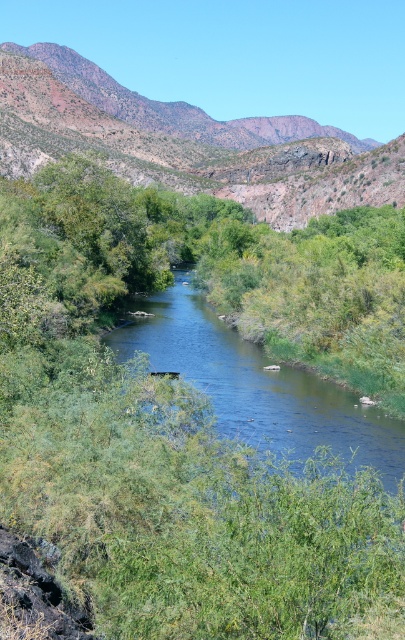
Question: From the image, what is the correct spatial relationship of brown rocky mountain at upper center in relation to clear water at center?

Choices:
 (A) right
 (B) left

Answer: (B)

Question: Does brown rocky mountain at upper center come behind clear water at center?

Choices:
 (A) no
 (B) yes

Answer: (B)

Question: Is brown rocky mountain at upper center closer to camera compared to clear water at center?

Choices:
 (A) yes
 (B) no

Answer: (B)